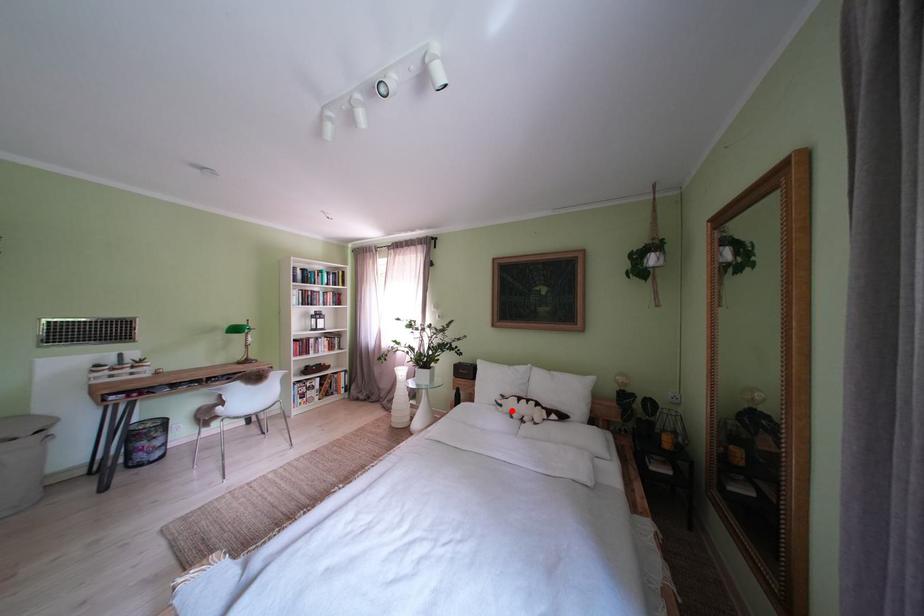
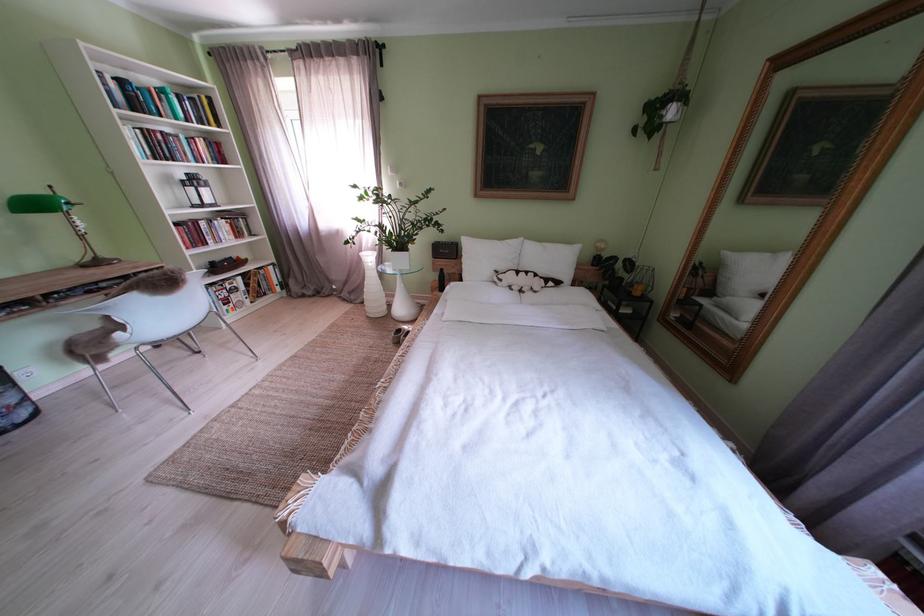
Question: I am providing you with two images of the same scene from different viewpoints. Image1 has a red point marked. In image2, the corresponding 3D location appears at what relative position? Reply with the corresponding letter.

Choices:
 (A) Closer
 (B) Farther

Answer: (A)